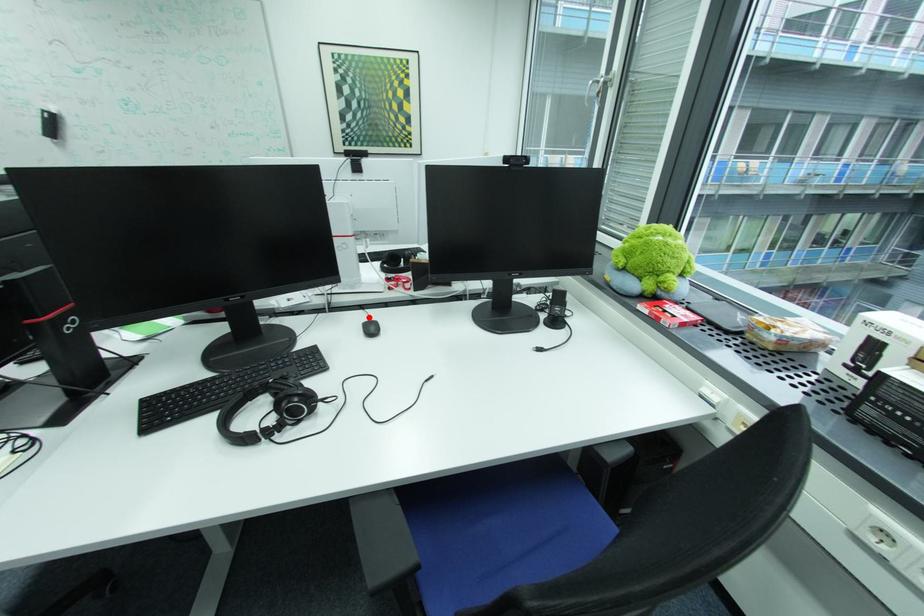
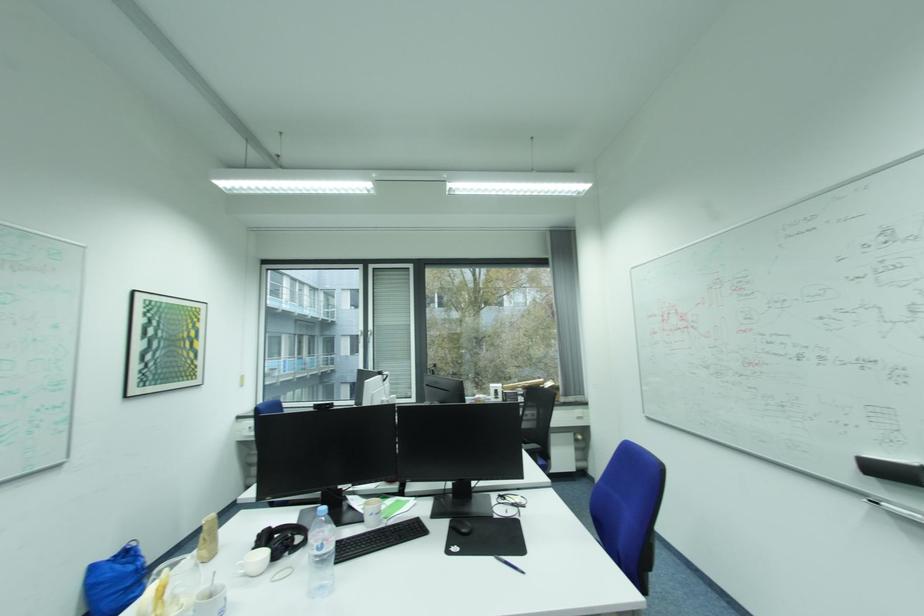
Question: I am providing you with two images of the same scene from different viewpoints. A red point is marked on the first image. Is the red point's position out of view in image 2?

Choices:
 (A) Yes
 (B) No

Answer: (A)